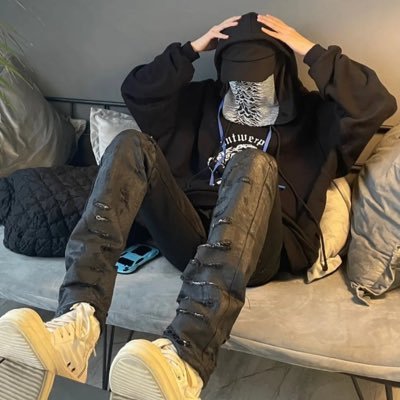
Where is `wall`? The width and height of the screenshot is (400, 400). wall is located at coordinates (85, 20).